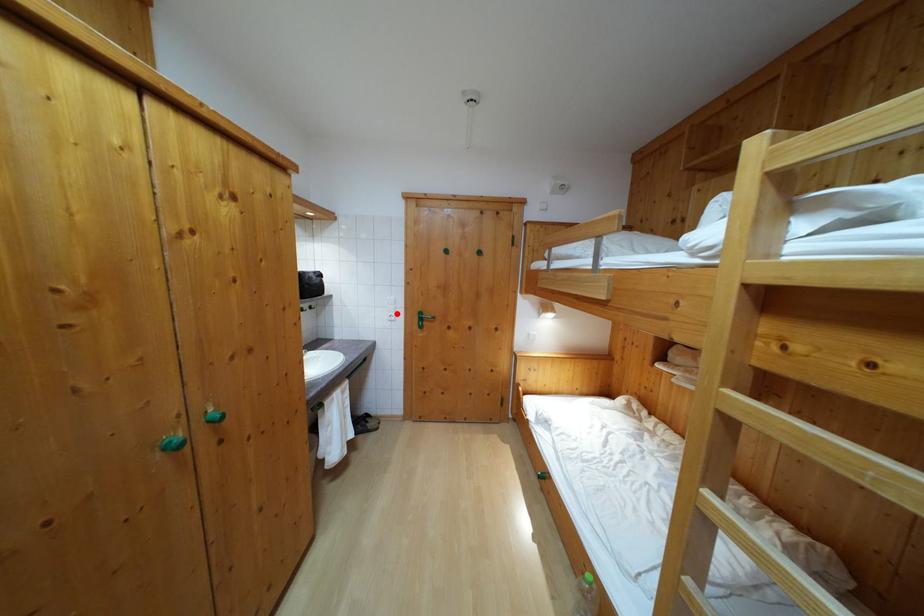
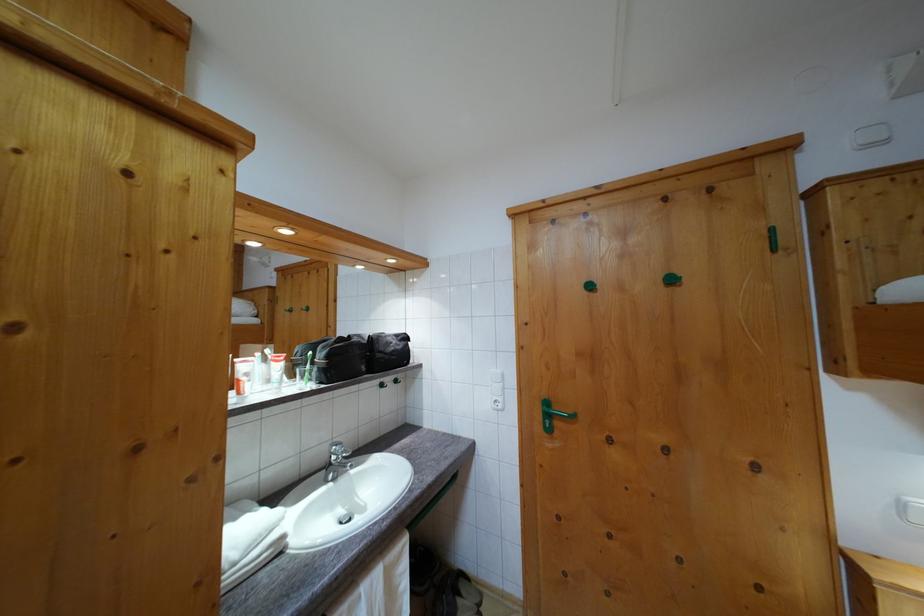
Where in the second image is the point corresponding to the highlighted location from the first image?

(504, 392)